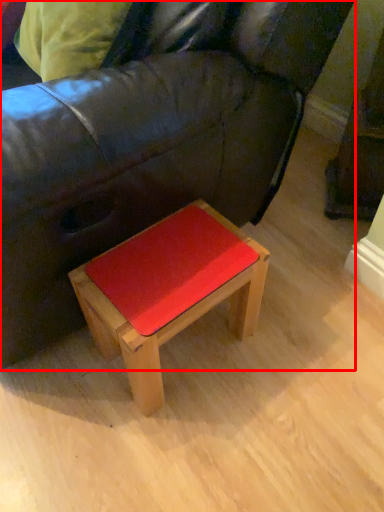
Question: From the image's perspective, what is the correct spatial relationship of studio couch (annotated by the red box) in relation to table?

Choices:
 (A) below
 (B) above

Answer: (B)